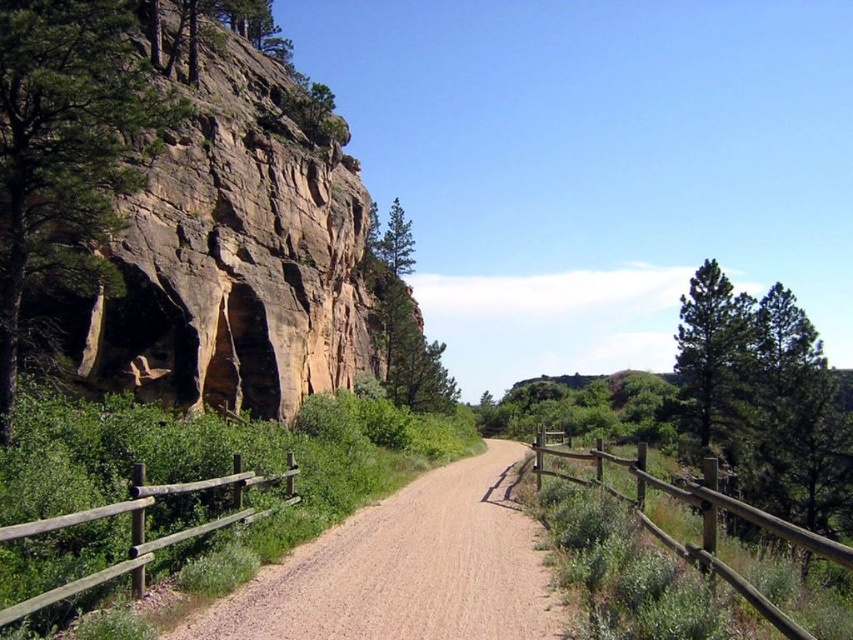
Question: Which point appears closest to the camera in this image?

Choices:
 (A) (1, 314)
 (B) (780, 618)

Answer: (B)

Question: Which object is the farthest from the green matte tree at right?

Choices:
 (A) brown gravel path at center
 (B) brown wooden fence at right
 (C) green textured pine tree at center

Answer: (A)

Question: Does brown gravel path at center appear on the left side of brown wooden fence at right?

Choices:
 (A) no
 (B) yes

Answer: (B)

Question: Is brown wooden fence at right above green textured pine tree at center?

Choices:
 (A) yes
 (B) no

Answer: (B)

Question: Which of these objects is positioned farthest from the brown wooden fence at right?

Choices:
 (A) brown gravel path at center
 (B) green matte tree at right

Answer: (B)

Question: Can you confirm if brown gravel path at center is wider than brown wooden fence at lower left?

Choices:
 (A) no
 (B) yes

Answer: (B)